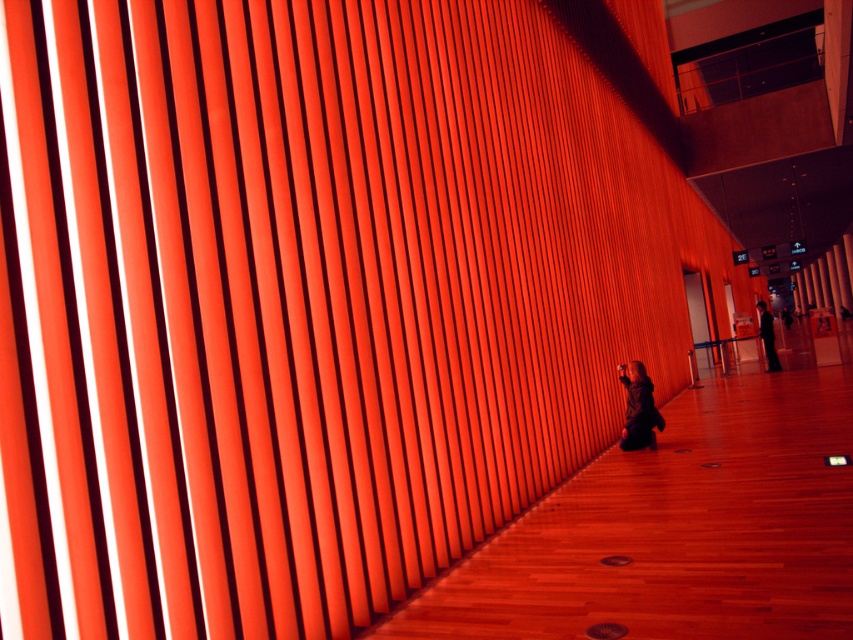
Question: Can you confirm if matte black jacket at lower center is positioned to the right of dark suit at center?

Choices:
 (A) yes
 (B) no

Answer: (B)

Question: Among these points, which one is nearest to the camera?

Choices:
 (A) (770, 332)
 (B) (635, 433)

Answer: (B)

Question: Where is matte black jacket at lower center located in relation to dark suit at center in the image?

Choices:
 (A) below
 (B) above

Answer: (A)

Question: Which of the following is the closest to the observer?

Choices:
 (A) dark suit at center
 (B) matte black jacket at lower center

Answer: (B)

Question: Which object is farther from the camera taking this photo?

Choices:
 (A) matte black jacket at lower center
 (B) dark suit at center

Answer: (B)

Question: Is matte black jacket at lower center to the right of dark suit at center from the viewer's perspective?

Choices:
 (A) no
 (B) yes

Answer: (A)